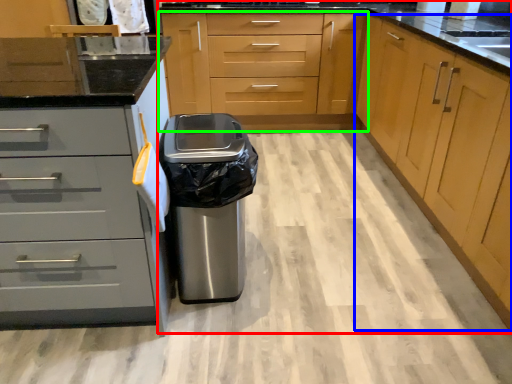
Question: Considering the real-world distances, which object is closest to cabinetry (highlighted by a red box)? cabinetry (highlighted by a blue box) or cabinetry (highlighted by a green box).

Choices:
 (A) cabinetry
 (B) cabinetry

Answer: (B)